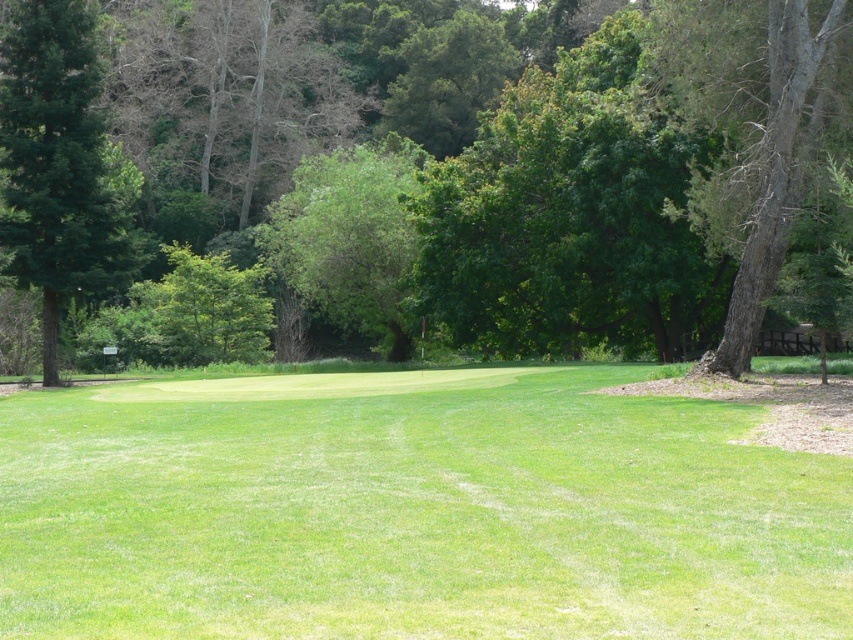
Question: In this image, where is green smooth grass at center located relative to green leafy tree at center?

Choices:
 (A) right
 (B) left

Answer: (A)

Question: Does green matte tree at left have a larger size compared to smooth gray bark tree at right?

Choices:
 (A) yes
 (B) no

Answer: (A)

Question: Which object is positioned closest to the green matte tree at left?

Choices:
 (A) green leafy tree at center
 (B) green smooth grass at center

Answer: (A)

Question: Which object is the closest to the smooth gray bark tree at right?

Choices:
 (A) green leafy tree at center
 (B) green matte tree at left

Answer: (B)

Question: Which is farther from the smooth gray bark tree at right?

Choices:
 (A) green matte tree at left
 (B) green smooth grass at center
 (C) green leafy tree at center

Answer: (C)

Question: Is green leafy tree at center positioned before green matte tree at left?

Choices:
 (A) no
 (B) yes

Answer: (B)